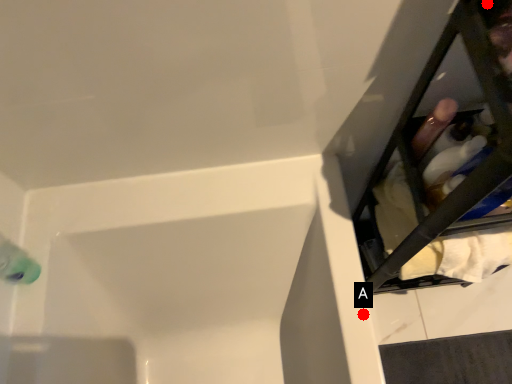
Question: Two points are circled on the image, labeled by A and B beside each circle. Which point is farther from the camera taking this photo?

Choices:
 (A) A is further
 (B) B is further

Answer: (A)